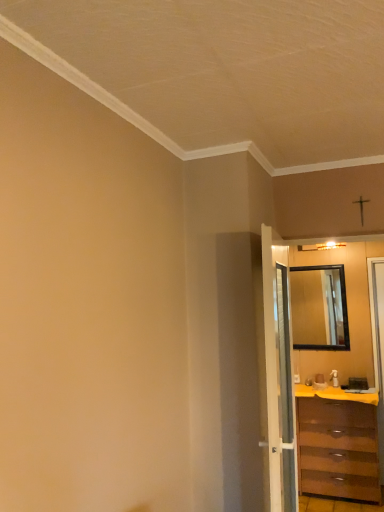
Question: Should I look upward or downward to see white glossy door at center?

Choices:
 (A) up
 (B) down

Answer: (B)

Question: Can black glass mirror at right be found inside brown wooden chest of drawers at right?

Choices:
 (A) yes
 (B) no

Answer: (B)

Question: Is brown wooden chest of drawers at right far away from black glass mirror at right?

Choices:
 (A) no
 (B) yes

Answer: (A)

Question: Is brown wooden chest of drawers at right taller than black glass mirror at right?

Choices:
 (A) no
 (B) yes

Answer: (B)

Question: Does brown wooden chest of drawers at right have a smaller size compared to black glass mirror at right?

Choices:
 (A) yes
 (B) no

Answer: (B)

Question: From a real-world perspective, is brown wooden chest of drawers at right beneath black glass mirror at right?

Choices:
 (A) no
 (B) yes

Answer: (B)

Question: Is brown wooden chest of drawers at right looking in the opposite direction of black glass mirror at right?

Choices:
 (A) yes
 (B) no

Answer: (B)

Question: From the image's perspective, does brown wooden chest of drawers at right appear lower than white glossy door at center?

Choices:
 (A) yes
 (B) no

Answer: (A)

Question: From a real-world perspective, is brown wooden chest of drawers at right beneath white glossy door at center?

Choices:
 (A) yes
 (B) no

Answer: (A)

Question: Is white glossy door at center inside brown wooden chest of drawers at right?

Choices:
 (A) no
 (B) yes

Answer: (A)

Question: Is brown wooden chest of drawers at right directly adjacent to white glossy door at center?

Choices:
 (A) yes
 (B) no

Answer: (B)

Question: From a real-world perspective, is brown wooden chest of drawers at right located higher than white glossy door at center?

Choices:
 (A) yes
 (B) no

Answer: (B)

Question: Considering the relative positions of brown wooden chest of drawers at right and white glossy door at center in the image provided, is brown wooden chest of drawers at right to the left of white glossy door at center from the viewer's perspective?

Choices:
 (A) yes
 (B) no

Answer: (B)

Question: From the image's perspective, would you say brown wooden chest of drawers at right is positioned over yellow matte counter top at lower right?

Choices:
 (A) yes
 (B) no

Answer: (B)